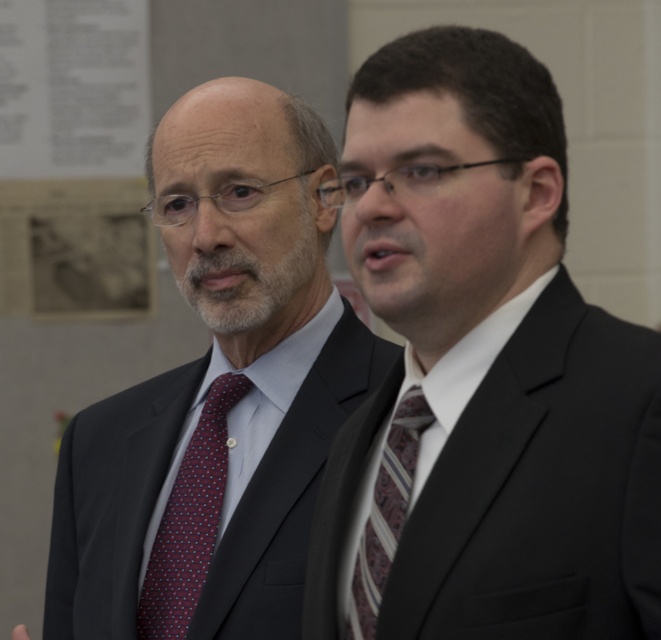
In the scene shown: You are a tailor who needs to adjust the size of the dark suit at right and the dark red textured tie at left to ensure they fit perfectly. Based on the image, which item requires more significant size adjustments?

The dark suit at right requires more significant size adjustments because it has a larger size compared to the dark red textured tie at left.

You are an event planner arranging a photo shoot. You need to position two items in the scene such that the matte black suit at left is above the dark red textured tie at left. Which object should be placed higher?

The matte black suit at left should be placed higher since it is located above the dark red textured tie at left according to the description.